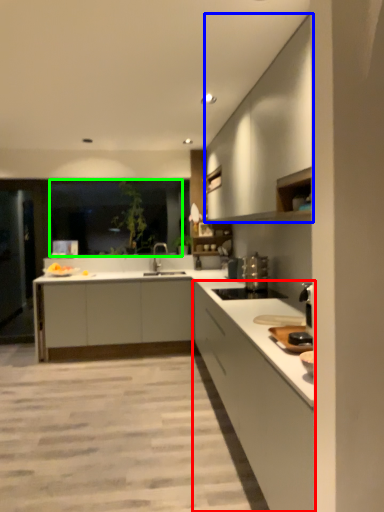
Question: Estimate the real-world distances between objects in this image. Which object is farther from cabinetry (highlighted by a red box), cabinetry (highlighted by a blue box) or window screen (highlighted by a green box)?

Choices:
 (A) cabinetry
 (B) window screen

Answer: (B)